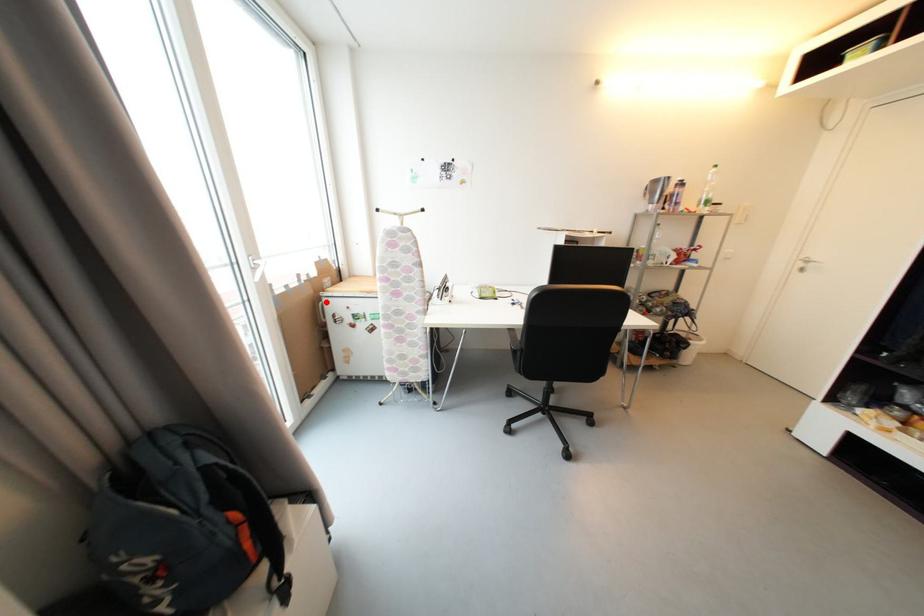
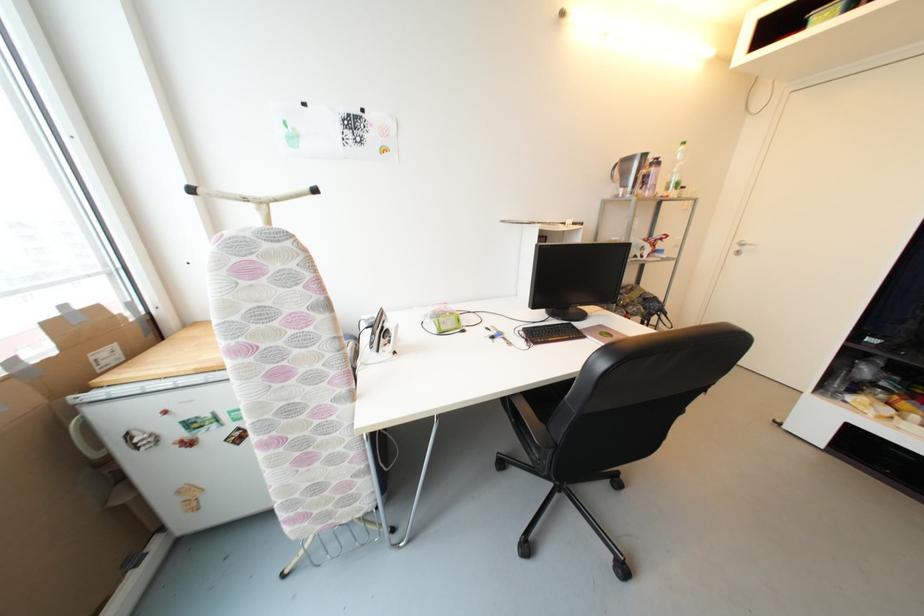
Question: I am providing you with two images of the same scene from different viewpoints. Given a red point in image1, look at the same physical point in image2. Is it:

Choices:
 (A) Closer to the viewpoint
 (B) Farther from the viewpoint

Answer: (B)